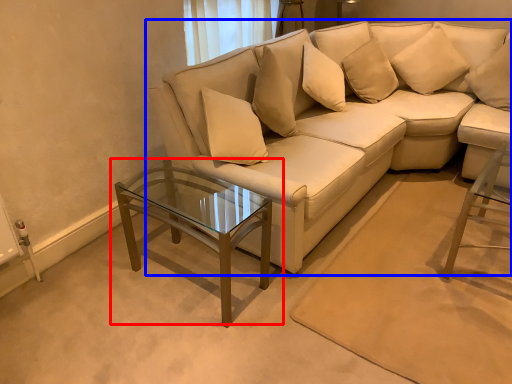
Question: Which point is further to the camera, coffee table (highlighted by a red box) or studio couch (highlighted by a blue box)?

Choices:
 (A) coffee table
 (B) studio couch

Answer: (B)